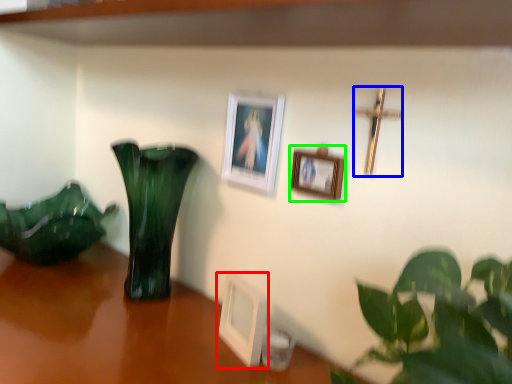
Question: Which object is positioned closest to picture frame (highlighted by a red box)? Select from crucifix (highlighted by a blue box) and picture frame (highlighted by a green box).

Choices:
 (A) crucifix
 (B) picture frame

Answer: (B)